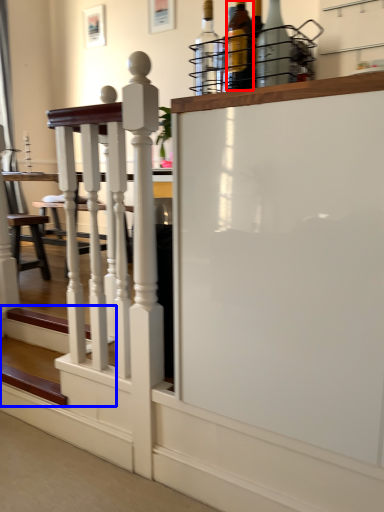
Question: Which of the following is the farthest to the observer, bottle (highlighted by a red box) or stairs (highlighted by a blue box)?

Choices:
 (A) bottle
 (B) stairs

Answer: (B)